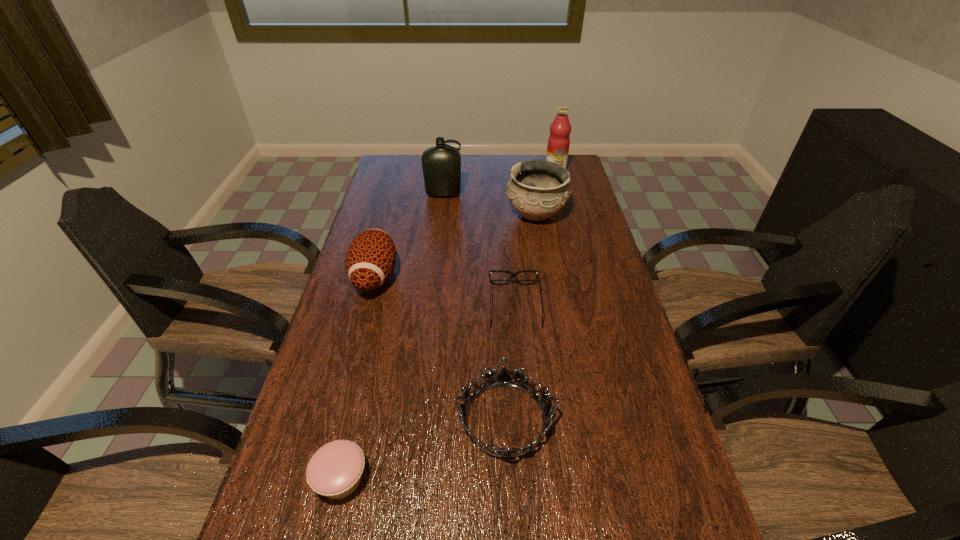
In order to click on pottery that is at the right edge in this screenshot , I will do click(537, 189).

Locate an element on the screen. The image size is (960, 540). object at the far right corner is located at coordinates (559, 141).

Identify the location of free space at the far edge. (497, 177).

At what (x,y) coordinates should I click in order to perform the action: click on vacant space at the left edge. Please return your answer as a coordinate pair (x, y). Looking at the image, I should click on (300, 507).

The image size is (960, 540). Find the location of `blank space at the right edge of the desktop`. blank space at the right edge of the desktop is located at coordinates (608, 455).

Image resolution: width=960 pixels, height=540 pixels. In order to click on vacant space at the far left corner in this screenshot , I will do `click(397, 181)`.

Locate an element on the screen. The width and height of the screenshot is (960, 540). vacant area at the far right corner of the desktop is located at coordinates (538, 159).

Where is `vacant space that's between the fifth object from right to left and the spectacles`? vacant space that's between the fifth object from right to left and the spectacles is located at coordinates (479, 250).

I want to click on free space between the third object from left to right and the fruit juice, so click(x=499, y=182).

Where is `empty location between the cupcake and the tiara`? The image size is (960, 540). empty location between the cupcake and the tiara is located at coordinates (423, 449).